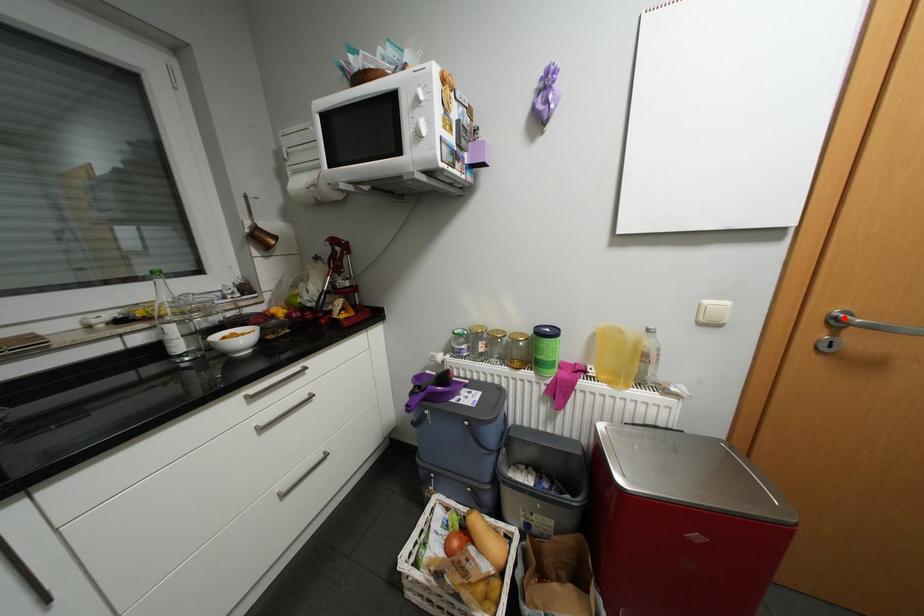
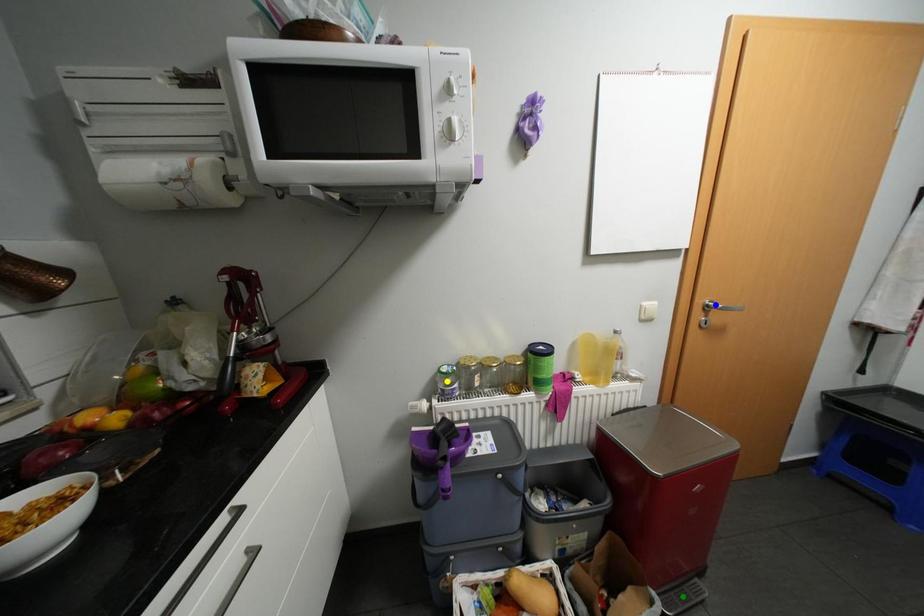
Question: I am providing you with two images of the same scene from different viewpoints. A red point is marked on the first image. You are given multiple points on the second image. Which spot in image 2 lines up with the point in image 1?

Choices:
 (A) yellow point
 (B) blue point
 (C) green point

Answer: (B)